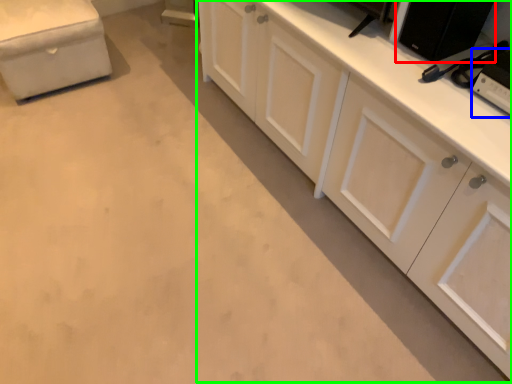
Question: Which object is positioned farthest from appliance (highlighted by a red box)? Select from appliance (highlighted by a blue box) and cabinetry (highlighted by a green box).

Choices:
 (A) appliance
 (B) cabinetry

Answer: (B)